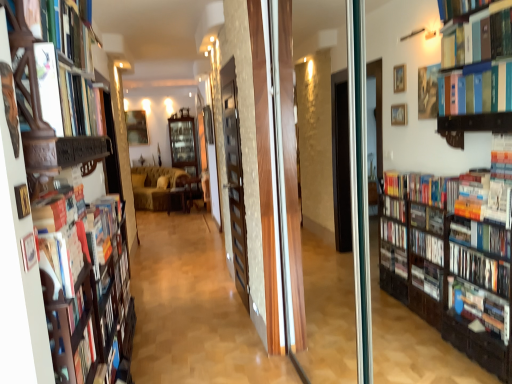
What is the approximate width of wooden bookshelf at left?

10.14 inches.

What do you see at coordinates (62, 30) in the screenshot?
I see `hardcover book at upper left, which ranks as the 2th book in bottom-to-top order` at bounding box center [62, 30].

Image resolution: width=512 pixels, height=384 pixels. What are the coordinates of `hardcover book at upper left, which ranks as the 1th book in top-to-bottom order` in the screenshot? It's located at (62, 30).

You are a GUI agent. You are given a task and a screenshot of the screen. Output one action in this format:
    pyautogui.click(x=<x>, y=<y>)
    Task: Click on the velvet yellow couch at center
    The image size is (512, 384).
    Given the screenshot: What is the action you would take?
    pyautogui.click(x=155, y=186)

This screenshot has height=384, width=512. In order to click on hardcover book at left, acting as the second book starting from the front in this screenshot , I will do `click(103, 228)`.

Which of these two, wooden screen door at center or hardcover book at left, which is the 1th book from bottom to top, is wider?

hardcover book at left, which is the 1th book from bottom to top, is wider.

From a real-world perspective, which is physically below, wooden screen door at center or hardcover book at left, which is the 1th book from bottom to top?

hardcover book at left, which is the 1th book from bottom to top.

Is wooden screen door at center behind hardcover book at left, which is the 1th book from bottom to top?

Yes.

Is wooden screen door at center situated inside hardcover book at left, acting as the second book starting from the front, or outside?

wooden screen door at center is not inside hardcover book at left, acting as the second book starting from the front, it's outside.

Is wooden cabinet at center, which is the 2th shelf in right-to-left order, far from velvet yellow couch at center?

They are positioned close to each other.

At what (x,y) coordinates should I click in order to perform the action: click on shelf behind the velvet yellow couch at center. Please return your answer as a coordinate pair (x, y). The image size is (512, 384). Looking at the image, I should click on (183, 142).

Is wooden cabinet at center, which is the 2th shelf from front to back, positioned with its back to velvet yellow couch at center?

No, velvet yellow couch at center is not at the back of wooden cabinet at center, which is the 2th shelf from front to back.

In the scene shown: How many degrees apart are the facing directions of wooden cabinet at center, the first shelf from the left, and velvet yellow couch at center?

78.5 degrees separate the facing orientations of wooden cabinet at center, the first shelf from the left, and velvet yellow couch at center.

Can you confirm if hardcover book at upper left, the first book viewed from the front, is smaller than wooden bookshelf at left?

Indeed, hardcover book at upper left, the first book viewed from the front, has a smaller size compared to wooden bookshelf at left.

Would you consider hardcover book at upper left, the second book when ordered from back to front, to be distant from wooden bookshelf at left?

hardcover book at upper left, the second book when ordered from back to front, is positioned a significant distance from wooden bookshelf at left.

Is hardcover book at upper left, which ranks as the 2th book in bottom-to-top order, facing towards wooden bookshelf at left?

No, hardcover book at upper left, which ranks as the 2th book in bottom-to-top order, does not turn towards wooden bookshelf at left.

Which object is closer to the camera taking this photo, hardcover book at left, acting as the second book starting from the front, or wooden chair at center, which is counted as the 1th furniture, starting from the right?

hardcover book at left, acting as the second book starting from the front, is more forward.

Are hardcover book at left, positioned as the 1th book in back-to-front order, and wooden chair at center, which is counted as the 1th furniture, starting from the right, making contact?

No.

Which point is more distant from viewer, (97, 229) or (184, 184)?

The point (184, 184) is farther from the camera.

In the scene shown: Can you tell me how much hardcover book at left, which is the 1th book from bottom to top, and wooden chair at center, which appears as the 2th furniture when viewed from the left, differ in facing direction?

The facing directions of hardcover book at left, which is the 1th book from bottom to top, and wooden chair at center, which appears as the 2th furniture when viewed from the left, are 100 degrees apart.

From the picture: Considering the relative positions of hardcover book at upper left, the second book when ordered from back to front, and wooden chair at center, which appears as the 2th furniture when viewed from the left, in the image provided, is hardcover book at upper left, the second book when ordered from back to front, in front of wooden chair at center, which appears as the 2th furniture when viewed from the left,?

That is True.

Is point (87, 36) more distant than point (183, 182)?

That is False.

Where is `book that is the 2nd object located in front of the wooden chair at center, which appears as the 2th furniture when viewed from the left`? The image size is (512, 384). book that is the 2nd object located in front of the wooden chair at center, which appears as the 2th furniture when viewed from the left is located at coordinates (62, 30).

Is hardcover book at upper left, the second book when ordered from back to front, inside the boundaries of wooden chair at center, which appears as the 2th furniture when viewed from the left, or outside?

hardcover book at upper left, the second book when ordered from back to front, is outside wooden chair at center, which appears as the 2th furniture when viewed from the left.

Looking at their sizes, would you say wooden picture frame at center is wider or thinner than wooden cabinet at center, which is the 2th shelf from front to back?

In the image, wooden picture frame at center appears to be more narrow than wooden cabinet at center, which is the 2th shelf from front to back.

From the image's perspective, is wooden picture frame at center beneath wooden cabinet at center, the first shelf from the left?

No.

In the image, is wooden picture frame at center positioned in front of or behind wooden cabinet at center, which is the 2th shelf from front to back?

wooden picture frame at center is behind wooden cabinet at center, which is the 2th shelf from front to back.

Which is correct: wooden picture frame at center is inside wooden cabinet at center, the first shelf from the left, or outside of it?

wooden picture frame at center lies outside wooden cabinet at center, the first shelf from the left.

Considering the relative positions of wooden cabinet at center, which is the 2th shelf in right-to-left order, and hardcover book at upper left, which ranks as the 1th book in top-to-bottom order, in the image provided, is wooden cabinet at center, which is the 2th shelf in right-to-left order, behind hardcover book at upper left, which ranks as the 1th book in top-to-bottom order,?

Yes, wooden cabinet at center, which is the 2th shelf in right-to-left order, is behind hardcover book at upper left, which ranks as the 1th book in top-to-bottom order.

From the image's perspective, which is below, wooden cabinet at center, the first shelf from the left, or hardcover book at upper left, which ranks as the 1th book in top-to-bottom order?

hardcover book at upper left, which ranks as the 1th book in top-to-bottom order.

Can you confirm if wooden cabinet at center, which is the 2th shelf in right-to-left order, is smaller than hardcover book at upper left, which ranks as the 2th book in bottom-to-top order?

Incorrect, wooden cabinet at center, which is the 2th shelf in right-to-left order, is not smaller in size than hardcover book at upper left, which ranks as the 2th book in bottom-to-top order.

Considering the relative sizes of wooden cabinet at center, which is the 2th shelf in right-to-left order, and hardcover book at upper left, the first book viewed from the front, in the image provided, is wooden cabinet at center, which is the 2th shelf in right-to-left order, thinner than hardcover book at upper left, the first book viewed from the front,?

In fact, wooden cabinet at center, which is the 2th shelf in right-to-left order, might be wider than hardcover book at upper left, the first book viewed from the front.

Where is `book that is below the wooden screen door at center (from the image's perspective)`? book that is below the wooden screen door at center (from the image's perspective) is located at coordinates (103, 228).

This screenshot has width=512, height=384. Find the location of `the 2nd shelf above the velvet yellow couch at center (from the image's perspective)`. the 2nd shelf above the velvet yellow couch at center (from the image's perspective) is located at coordinates click(x=183, y=142).

When comparing their distances from wooden picture frame at center, does wooden chair at center, which appears as the 2th furniture when viewed from the left, or velvet yellow couch at center seem closer?

The object closer to wooden picture frame at center is velvet yellow couch at center.

Which object lies nearer to the anchor point wooden bookshelf at left, wooden bookshelf at left, which is the 1th shelf in right-to-left order, or wooden screen door at center?

wooden bookshelf at left, which is the 1th shelf in right-to-left order, is positioned closer to the anchor wooden bookshelf at left.

Which object lies further to the anchor point wooden bookshelf at left, which is the 1th shelf in right-to-left order, velvet yellow couch at center or wooden cabinet at center, which is the 2th shelf in right-to-left order?

wooden cabinet at center, which is the 2th shelf in right-to-left order.

Considering their positions, is wooden screen door at center positioned further to wooden chair at center, which is counted as the 1th furniture, starting from the right, than hardcover book at left, acting as the second book starting from the front?

hardcover book at left, acting as the second book starting from the front, is further to wooden chair at center, which is counted as the 1th furniture, starting from the right.

Based on their spatial positions, is wooden cabinet at center, which is the 2th shelf in right-to-left order, or hardcover book at left, the second book from the top, further from wooden bookshelf at left?

wooden cabinet at center, which is the 2th shelf in right-to-left order, is further to wooden bookshelf at left.

Looking at the image, which one is located closer to wooden bookshelf at left, hardcover book at upper left, which ranks as the 2th book in bottom-to-top order, or velvet yellow couch at center?

Based on the image, hardcover book at upper left, which ranks as the 2th book in bottom-to-top order, appears to be nearer to wooden bookshelf at left.

Considering their positions, is wooden cabinet at center, which is the 2th shelf in right-to-left order, positioned closer to wooden screen door at center than velvet yellow couch at center?

velvet yellow couch at center is closer to wooden screen door at center.

Which object lies further to the anchor point wooden chair at center, which is counted as the 1th furniture, starting from the right, wooden screen door at center or hardcover book at upper left, which ranks as the 1th book in top-to-bottom order?

hardcover book at upper left, which ranks as the 1th book in top-to-bottom order, is further to wooden chair at center, which is counted as the 1th furniture, starting from the right.

Locate an element on the screen. The width and height of the screenshot is (512, 384). book between wooden bookshelf at left and wooden picture frame at center along the z-axis is located at coordinates (103, 228).

At what (x,y) coordinates should I click in order to perform the action: click on shelf between wooden bookshelf at left and wooden picture frame at center in the front-back direction. Please return your answer as a coordinate pair (x, y). Looking at the image, I should click on (183, 142).

The height and width of the screenshot is (384, 512). In order to click on shelf between hardcover book at upper left, the first book viewed from the front, and wooden bookshelf at left from top to bottom in this screenshot , I will do `click(39, 104)`.

In order to click on couch located between wooden bookshelf at left, which is the 1th shelf in right-to-left order, and wooden cabinet at center, acting as the 1th shelf starting from the back, in the depth direction in this screenshot , I will do `click(155, 186)`.